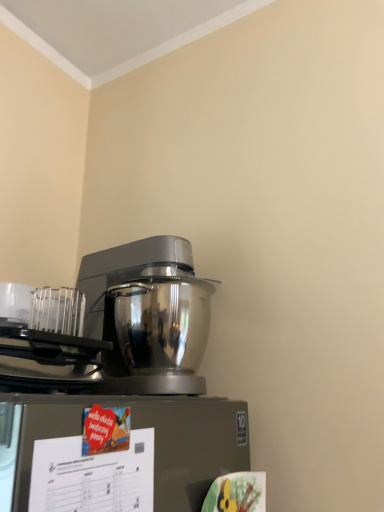
Where is `satin silver mixer at center`? satin silver mixer at center is located at coordinates (148, 314).

What do you see at coordinates (148, 314) in the screenshot? I see `satin silver mixer at center` at bounding box center [148, 314].

The image size is (384, 512). Describe the element at coordinates (46, 338) in the screenshot. I see `brushed metal stand mixer at left` at that location.

You are a GUI agent. You are given a task and a screenshot of the screen. Output one action in this format:
    pyautogui.click(x=<x>, y=<y>)
    Task: Click on the brushed metal stand mixer at left
    
    Given the screenshot: What is the action you would take?
    pyautogui.click(x=46, y=338)

I want to click on satin silver mixer at center, so click(x=148, y=314).

Considering the relative positions of brushed metal stand mixer at left and satin silver mixer at center in the image provided, is brushed metal stand mixer at left to the right of satin silver mixer at center from the viewer's perspective?

No.

Which is behind, brushed metal stand mixer at left or satin silver mixer at center?

satin silver mixer at center.

Does point (67, 351) come behind point (195, 389)?

No.

From the image's perspective, would you say brushed metal stand mixer at left is positioned over satin silver mixer at center?

Incorrect, from the image's perspective, brushed metal stand mixer at left is lower than satin silver mixer at center.

From a real-world perspective, which is physically above, brushed metal stand mixer at left or satin silver mixer at center?

satin silver mixer at center is physically above.

Considering the relative sizes of brushed metal stand mixer at left and satin silver mixer at center in the image provided, is brushed metal stand mixer at left wider than satin silver mixer at center?

In fact, brushed metal stand mixer at left might be narrower than satin silver mixer at center.

Is brushed metal stand mixer at left taller or shorter than satin silver mixer at center?

In the image, brushed metal stand mixer at left appears to be shorter than satin silver mixer at center.

Does brushed metal stand mixer at left have a smaller size compared to satin silver mixer at center?

Yes, brushed metal stand mixer at left is smaller than satin silver mixer at center.

Is brushed metal stand mixer at left spatially inside satin silver mixer at center, or outside of it?

brushed metal stand mixer at left is outside satin silver mixer at center.

Is brushed metal stand mixer at left touching satin silver mixer at center?

brushed metal stand mixer at left is not next to satin silver mixer at center, and they're not touching.

Could you tell me if brushed metal stand mixer at left is turned towards satin silver mixer at center?

No, brushed metal stand mixer at left is not aimed at satin silver mixer at center.

Image resolution: width=384 pixels, height=512 pixels. What are the coordinates of `mixer above the brushed metal stand mixer at left (from the image's perspective)` in the screenshot? It's located at (148, 314).

Which object is positioned more to the right, satin silver mixer at center or brushed metal stand mixer at left?

satin silver mixer at center is more to the right.

Does satin silver mixer at center lie in front of brushed metal stand mixer at left?

That is False.

Considering the positions of points (150, 277) and (66, 315), is point (150, 277) closer to camera compared to point (66, 315)?

Yes, it is.

From the image's perspective, which object appears higher, satin silver mixer at center or brushed metal stand mixer at left?

satin silver mixer at center is shown above in the image.

From a real-world perspective, who is located higher, satin silver mixer at center or brushed metal stand mixer at left?

satin silver mixer at center is physically above.

Considering the sizes of satin silver mixer at center and brushed metal stand mixer at left in the image, is satin silver mixer at center wider or thinner than brushed metal stand mixer at left?

Clearly, satin silver mixer at center has more width compared to brushed metal stand mixer at left.

In terms of height, does satin silver mixer at center look taller or shorter compared to brushed metal stand mixer at left?

satin silver mixer at center is taller than brushed metal stand mixer at left.

Does satin silver mixer at center have a smaller size compared to brushed metal stand mixer at left?

No.

Does satin silver mixer at center contain brushed metal stand mixer at left?

No, brushed metal stand mixer at left is located outside of satin silver mixer at center.

Is satin silver mixer at center next to brushed metal stand mixer at left?

No.

Is satin silver mixer at center positioned with its back to brushed metal stand mixer at left?

No.

What's the angular difference between satin silver mixer at center and brushed metal stand mixer at left's facing directions?

The angular difference between satin silver mixer at center and brushed metal stand mixer at left is 0.733 degrees.

At what (x,y) coordinates should I click in order to perform the action: click on mixer behind the brushed metal stand mixer at left. Please return your answer as a coordinate pair (x, y). The height and width of the screenshot is (512, 384). Looking at the image, I should click on (148, 314).

Locate an element on the screen. mixer behind the brushed metal stand mixer at left is located at coordinates (148, 314).

Where is `appliance below the satin silver mixer at center (from a real-world perspective)`? appliance below the satin silver mixer at center (from a real-world perspective) is located at coordinates (46, 338).